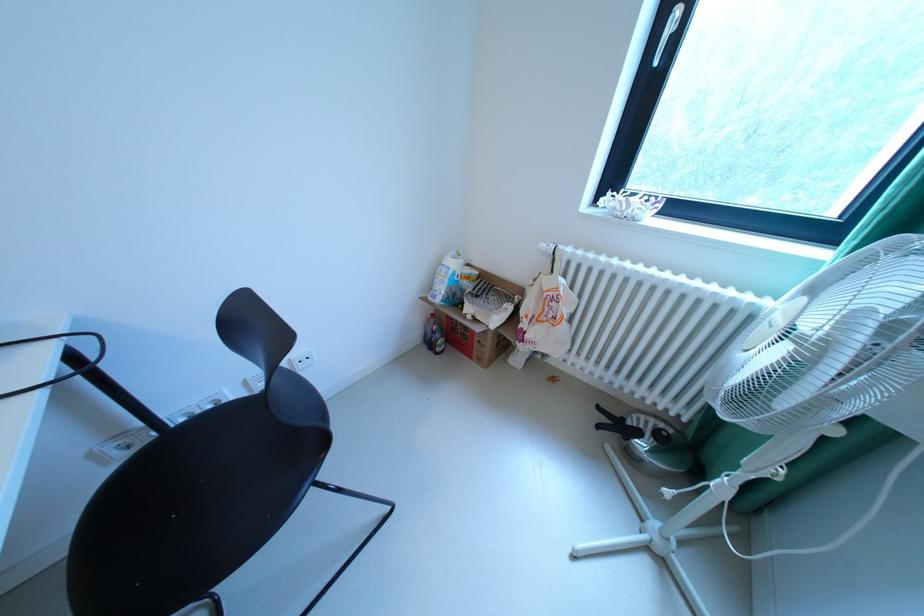
Image resolution: width=924 pixels, height=616 pixels. Identify the location of black chair sitting surface. (211, 485).